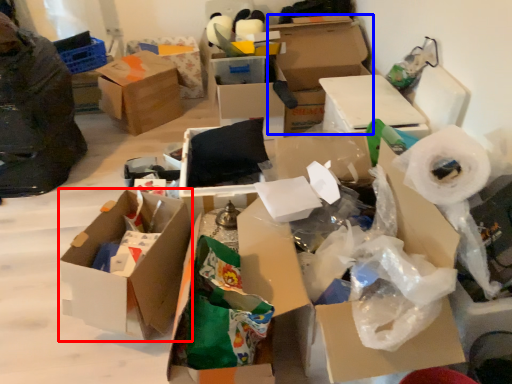
Question: Which of the following is the closest to the observer, box (highlighted by a red box) or box (highlighted by a blue box)?

Choices:
 (A) box
 (B) box

Answer: (A)